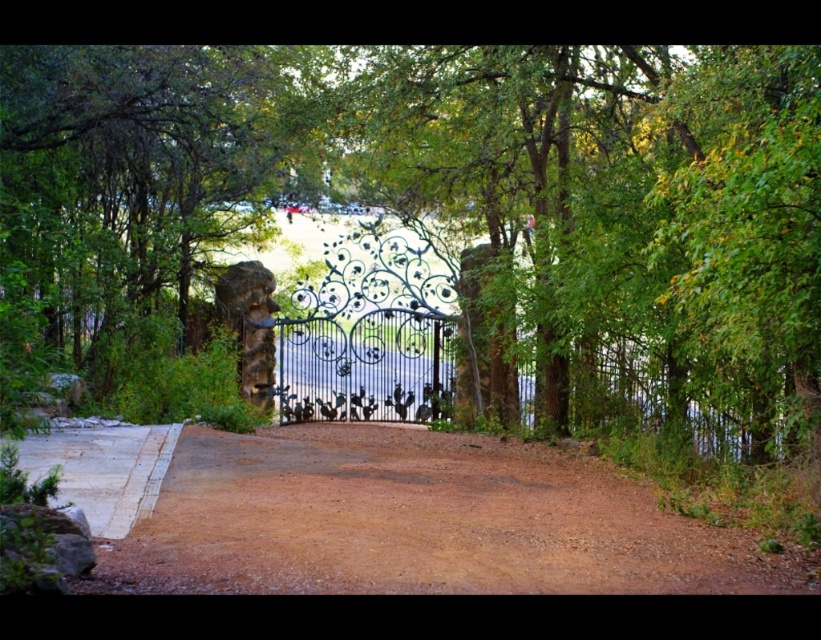
You are standing at the entrance of the property and want to walk to the gate. You see the brown gravel driveway at center and the green leafy tree at left. Which direction should you walk to reach the gate?

You should walk to the right of the green leafy tree at left because the brown gravel driveway at center is located to the right of it, leading towards the gate.

You are driving a delivery van that is 2 meters wide. You arrive at this property and need to enter through the gate. The brown gravel driveway at center and the green leafy tree at left are in your path. Can your van fit through the driveway without hitting the tree?

The brown gravel driveway at center might be wider than green leafy tree at left. Since the driveway is possibly wider than the tree, the van might have enough space to pass through without hitting the tree, but there is uncertainty due to the comparative width not being definitively stated.